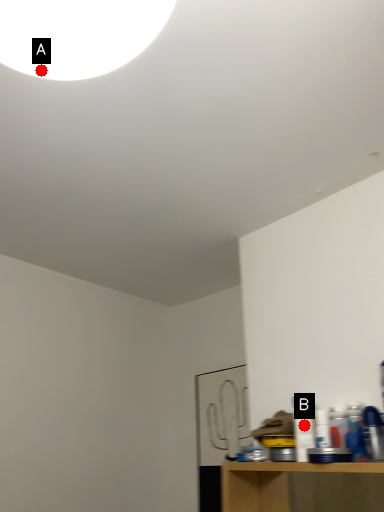
Question: Two points are circled on the image, labeled by A and B beside each circle. Which point is closer to the camera taking this photo?

Choices:
 (A) A is closer
 (B) B is closer

Answer: (A)